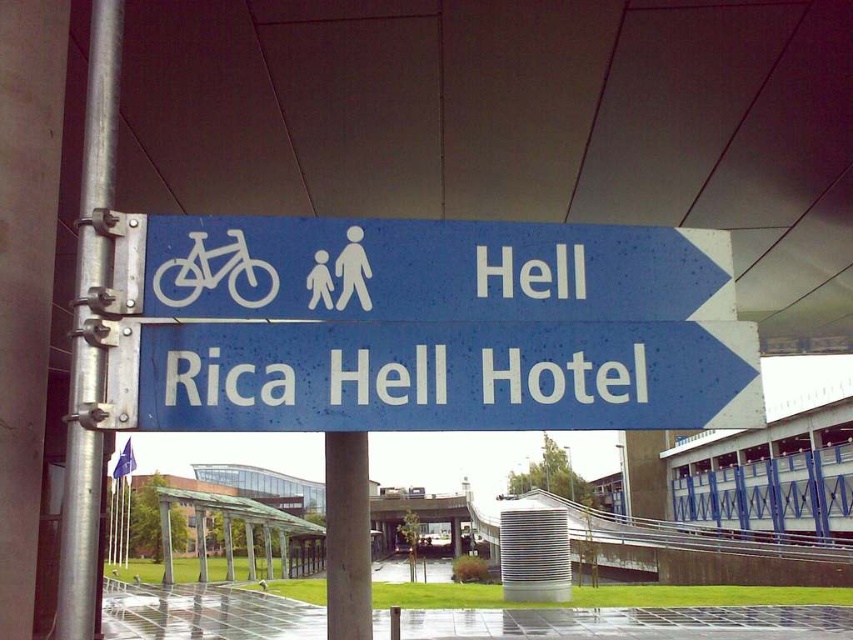
Who is lower down, blue plastic sign at center or silver metallic pole at left?

Positioned lower is blue plastic sign at center.

Does blue plastic sign at center appear over silver metallic pole at left?

No, blue plastic sign at center is not above silver metallic pole at left.

The height and width of the screenshot is (640, 853). Identify the location of blue plastic sign at center. (444, 376).

Who is higher up, blue plastic sign at upper center or silver metallic pole at left?

blue plastic sign at upper center is higher up.

Is point (387, 248) more distant than point (82, 280)?

Yes, it is.

Locate an element on the screen. blue plastic sign at upper center is located at coordinates (430, 269).

Locate an element on the screen. The width and height of the screenshot is (853, 640). blue plastic sign at upper center is located at coordinates (430, 269).

Can you confirm if silver metallic pole at left is shorter than smooth concrete pillar at center?

Yes.

What do you see at coordinates (90, 336) in the screenshot?
I see `silver metallic pole at left` at bounding box center [90, 336].

I want to click on silver metallic pole at left, so click(90, 336).